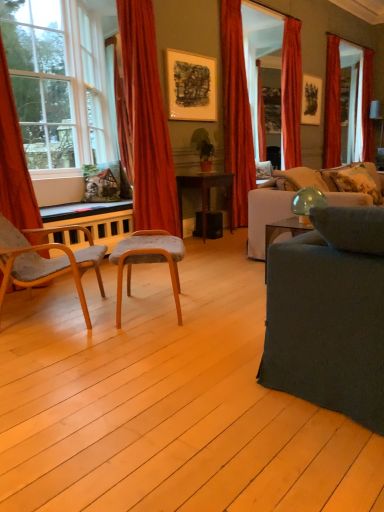
This screenshot has height=512, width=384. Identify the location of free space between wooden chair at left, positioned as the second chair in right-to-left order, and gray fabric stool at center, the 2th chair positioned from the left. (112, 313).